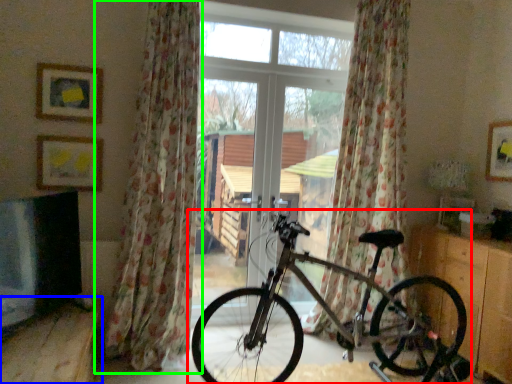
Question: Based on their relative distances, which object is farther from bicycle (highlighted by a red box)? Choose from furniture (highlighted by a blue box) and curtain (highlighted by a green box).

Choices:
 (A) furniture
 (B) curtain

Answer: (A)